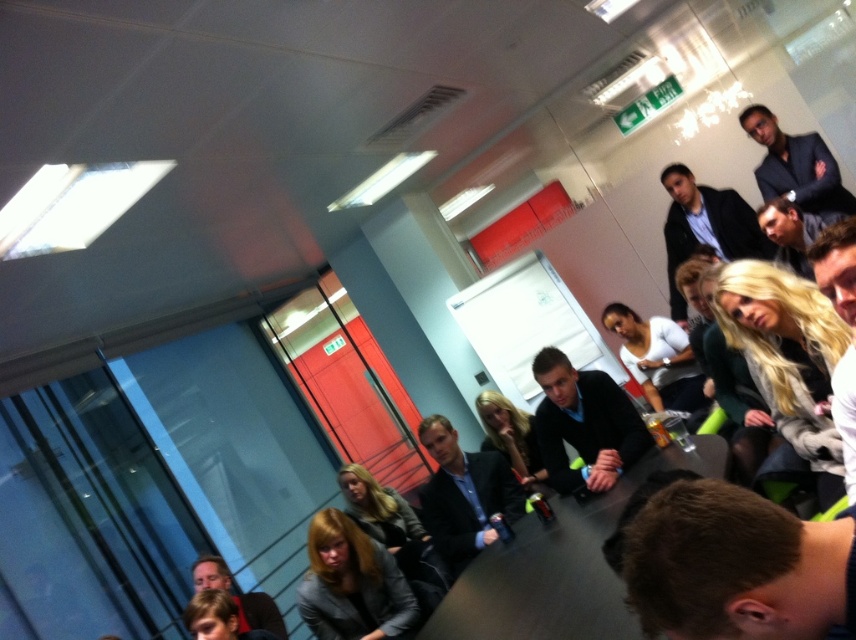
Question: Among these objects, which one is farthest from the camera?

Choices:
 (A) matte black jacket at upper right
 (B) brown hair at lower right
 (C) dark blue suit at upper right

Answer: (A)

Question: Is matte black jacket at upper right smaller than dark blue suit at upper right?

Choices:
 (A) yes
 (B) no

Answer: (B)

Question: Which object is the closest to the brown hair at lower right?

Choices:
 (A) black glossy table at center
 (B) matte black jacket at upper right
 (C) dark blue suit at upper right

Answer: (A)

Question: Which object is positioned farthest from the dark blue sweater at center?

Choices:
 (A) matte black suit at center
 (B) dark blue suit at upper right

Answer: (B)

Question: Is black glossy table at center smaller than dark blue suit at upper right?

Choices:
 (A) yes
 (B) no

Answer: (B)

Question: Does black glossy table at center lie in front of matte black suit at center?

Choices:
 (A) no
 (B) yes

Answer: (B)